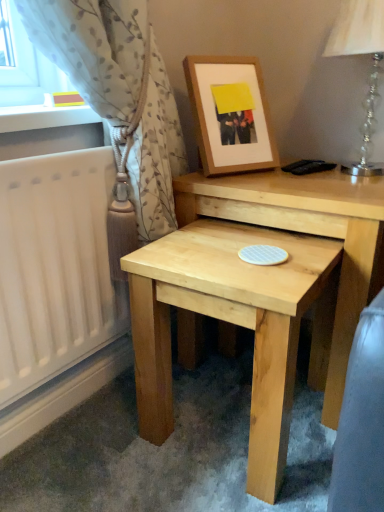
Question: From a real-world perspective, does clear crystal glass table lamp at upper right sit lower than wooden frame at upper center?

Choices:
 (A) no
 (B) yes

Answer: (A)

Question: From a real-world perspective, is clear crystal glass table lamp at upper right physically above wooden frame at upper center?

Choices:
 (A) yes
 (B) no

Answer: (A)

Question: Is clear crystal glass table lamp at upper right looking in the opposite direction of wooden frame at upper center?

Choices:
 (A) no
 (B) yes

Answer: (A)

Question: Considering the relative sizes of clear crystal glass table lamp at upper right and wooden frame at upper center in the image provided, is clear crystal glass table lamp at upper right bigger than wooden frame at upper center?

Choices:
 (A) no
 (B) yes

Answer: (B)

Question: Is clear crystal glass table lamp at upper right at the left side of wooden frame at upper center?

Choices:
 (A) yes
 (B) no

Answer: (B)

Question: Is clear crystal glass table lamp at upper right positioned beyond the bounds of wooden frame at upper center?

Choices:
 (A) no
 (B) yes

Answer: (B)

Question: Is light beige textured curtain at left not inside natural wood table at lower center, the first table in the front-to-back sequence?

Choices:
 (A) yes
 (B) no

Answer: (A)

Question: Is light beige textured curtain at left bigger than natural wood table at lower center, the first table in the front-to-back sequence?

Choices:
 (A) no
 (B) yes

Answer: (B)

Question: Is light beige textured curtain at left wider than natural wood table at lower center, placed as the 2th table when sorted from back to front?

Choices:
 (A) no
 (B) yes

Answer: (A)

Question: Considering the relative sizes of light beige textured curtain at left and natural wood table at lower center, the first table in the front-to-back sequence, in the image provided, is light beige textured curtain at left taller than natural wood table at lower center, the first table in the front-to-back sequence,?

Choices:
 (A) no
 (B) yes

Answer: (B)

Question: Does light beige textured curtain at left lie in front of natural wood table at lower center, placed as the 2th table when sorted from back to front?

Choices:
 (A) no
 (B) yes

Answer: (B)

Question: From a real-world perspective, is light beige textured curtain at left located beneath natural wood table at lower center, placed as the 2th table when sorted from back to front?

Choices:
 (A) no
 (B) yes

Answer: (A)

Question: From the image's perspective, would you say light beige textured curtain at left is shown under clear crystal glass table lamp at upper right?

Choices:
 (A) yes
 (B) no

Answer: (A)